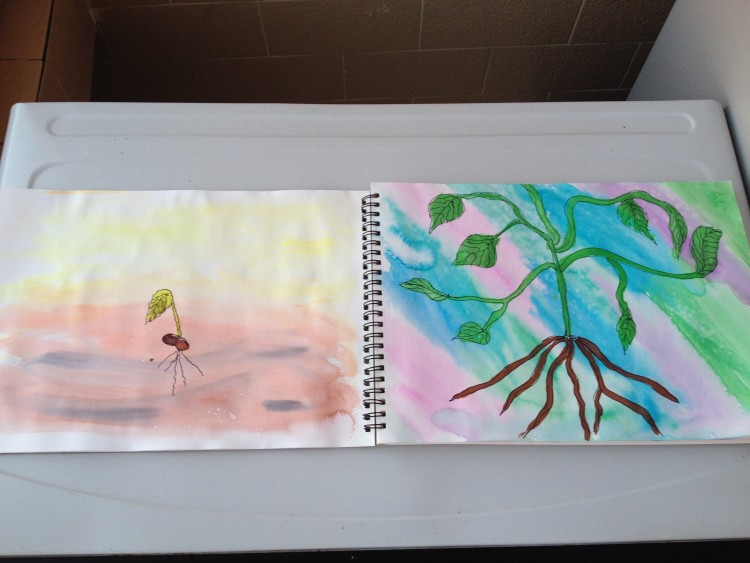
At what (x,y) coordinates should I click in order to perform the action: click on desk. Please return your answer as a coordinate pair (x, y). The image size is (750, 563). Looking at the image, I should click on (406, 485).